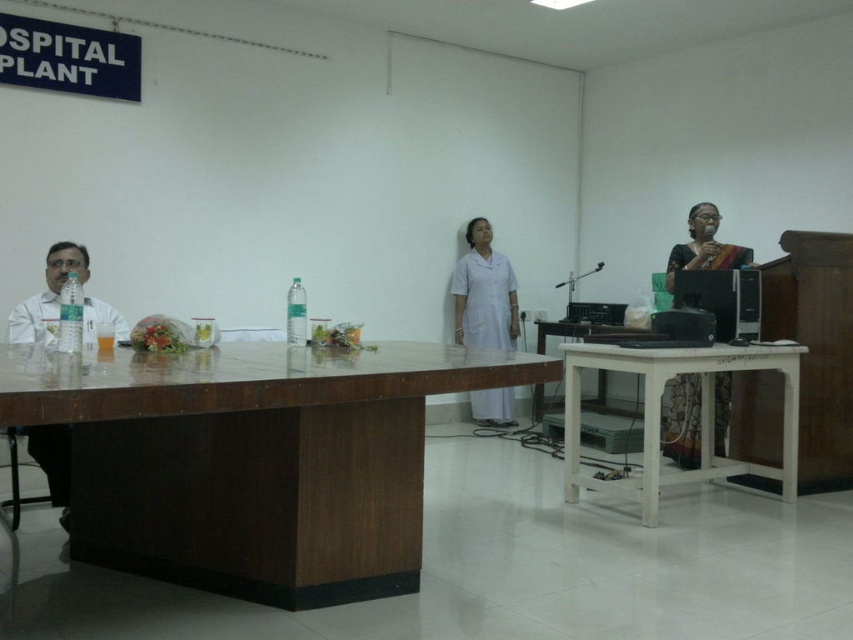
From the picture: You are a hospital staff member who needs to place a medical chart on the table closest to the wall. Which table should you choose between the brown wood table at center and the white wooden table at lower right?

The brown wood table at center is above the white wooden table at lower right, so the brown wood table at center is closer to the wall. Therefore, you should place the medical chart on the brown wood table at center.

You are a hospital staff member who needs to place a new medical chart on the nearest table. You see the brown wood table at center and the white wooden table at lower right. Which table should you choose?

You should choose the brown wood table at center because it is closer to you than the white wooden table at lower right.